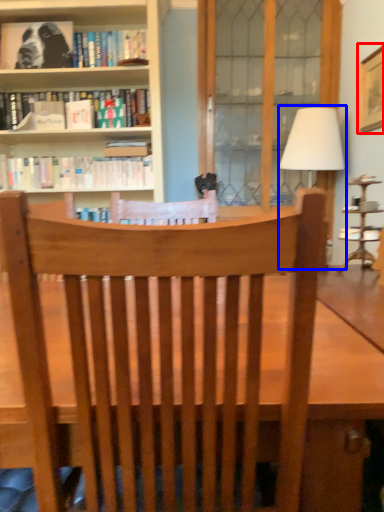
Question: Among these objects, which one is nearest to the camera, picture frame (highlighted by a red box) or table lamp (highlighted by a blue box)?

Choices:
 (A) picture frame
 (B) table lamp

Answer: (A)